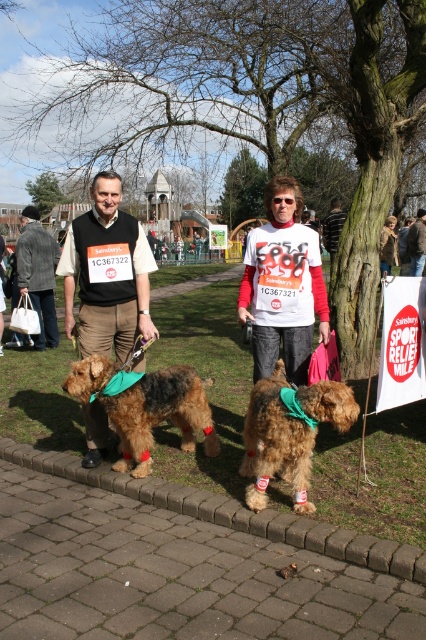
Question: Does white/red long-sleeved shirt at center appear on the left side of brown furry dog at center?

Choices:
 (A) no
 (B) yes

Answer: (B)

Question: Which point appears farthest from the camera in this image?

Choices:
 (A) (382, 246)
 (B) (140, 419)

Answer: (A)

Question: Among these points, which one is nearest to the camera?

Choices:
 (A) tap(152, 573)
 (B) tap(42, 260)

Answer: (A)

Question: Does striped sweater at center lie behind matte white t-shirt at center?

Choices:
 (A) yes
 (B) no

Answer: (A)

Question: Is paved brick pavement at lower center behind dark brown woolen jacket at left?

Choices:
 (A) yes
 (B) no

Answer: (B)

Question: Based on their relative distances, which object is nearer to the brown leather jacket at center?

Choices:
 (A) brown furry dog at center
 (B) paved brick pavement at lower center
 (C) matte black vest at center

Answer: (A)